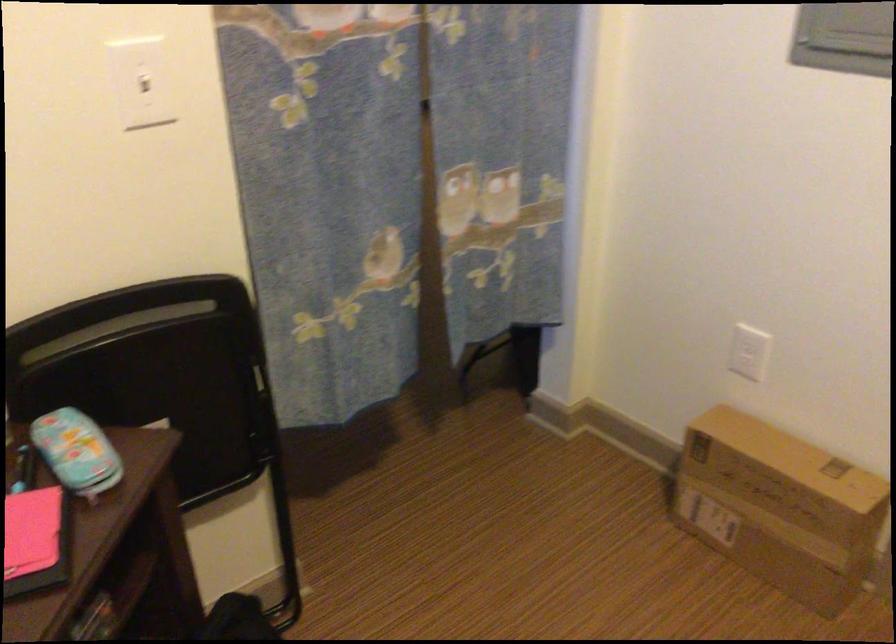
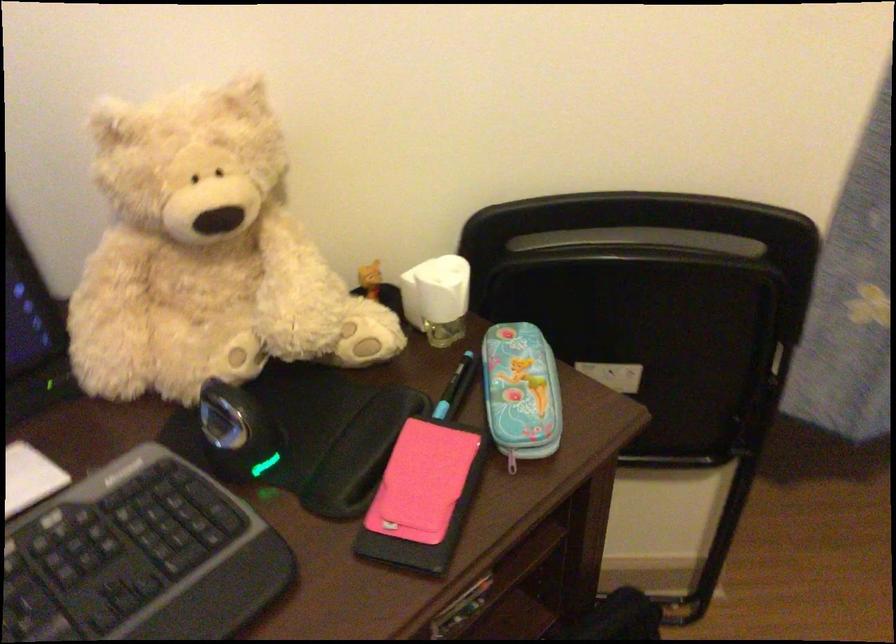
Where in the second image is the point corresponding to [142,319] from the first image?

(642, 240)